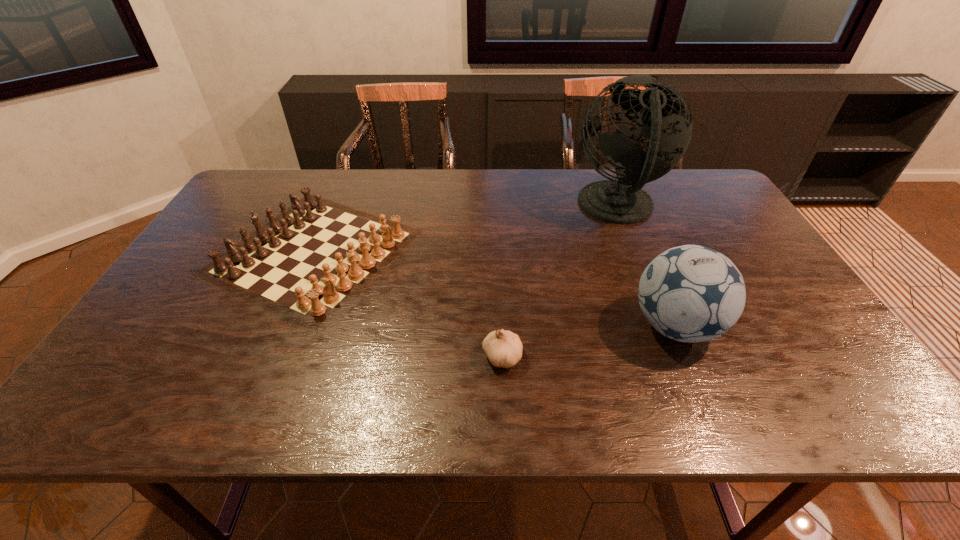
Locate an element on the screen. The height and width of the screenshot is (540, 960). free spot at the left edge of the desktop is located at coordinates (237, 224).

The width and height of the screenshot is (960, 540). In the image, there is a desktop. Identify the location of free space at the right edge. pyautogui.click(x=795, y=339).

This screenshot has width=960, height=540. What are the coordinates of `blank space at the far left corner of the desktop` in the screenshot? It's located at (277, 179).

Find the location of a particular element. The width and height of the screenshot is (960, 540). vacant space at the far right corner of the desktop is located at coordinates (709, 178).

Identify the location of vacant region between the tallest object and the garlic. (560, 282).

The width and height of the screenshot is (960, 540). What are the coordinates of `empty space between the soccer ball and the leftmost object` in the screenshot? It's located at (494, 289).

Identify the location of free spot between the second tallest object and the garlic. (588, 341).

What are the coordinates of `unoccupied position between the third object from right to left and the leftmost object` in the screenshot? It's located at (408, 304).

Find the location of `blank region between the shortest object and the second tallest object`. blank region between the shortest object and the second tallest object is located at coordinates (588, 341).

You are a GUI agent. You are given a task and a screenshot of the screen. Output one action in this format:
    pyautogui.click(x=<x>, y=<y>)
    Task: Click on the vacant point located between the second shortest object and the third shortest object
    This screenshot has width=960, height=540.
    Given the screenshot: What is the action you would take?
    pyautogui.click(x=494, y=289)